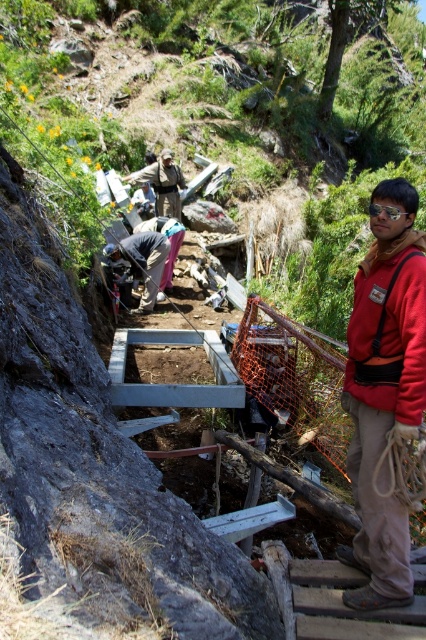
From the picture: You are an archaeologist at the excavation site. You need to secure a rope to the dark gray fabric at center. Given that the fabric is at point (141, 260), can you determine its exact location relative to the wooden platform?

The dark gray fabric at center is located at point (141, 260), which is the exact coordinates of its position relative to the wooden platform.

You are an archaeologist at the excavation site. You need to retrieve an artifact located at point [408,276]. Your current position is 10 feet away from the camera. Can you reach the artifact without moving closer than 8 feet from the camera?

The point [408,276] is 8.74 feet away from the camera. Since you are currently 10 feet away, you need to move 1.26 feet closer to reach it. However, moving to 8.74 feet would place you within the 8 feet threshold, so you cannot reach the artifact without moving closer than 8 feet from the camera.

You are an archaeologist standing at the point labeled as point (382, 477) on the wooden platform. You need to retrieve a tool that is exactly 2.5 meters away from your current position. Can you reach it without moving from your spot?

The point labeled as point (382, 477) is 2.76 meters away from the camera. Since the tool is only 2.5 meters away from your current position, you can reach it without moving because 2.5 meters is less than 2.76 meters.